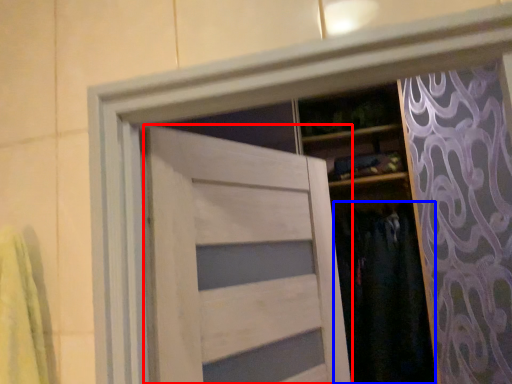
Question: Which point is closer to the camera, door (highlighted by a red box) or clothing (highlighted by a blue box)?

Choices:
 (A) door
 (B) clothing

Answer: (A)